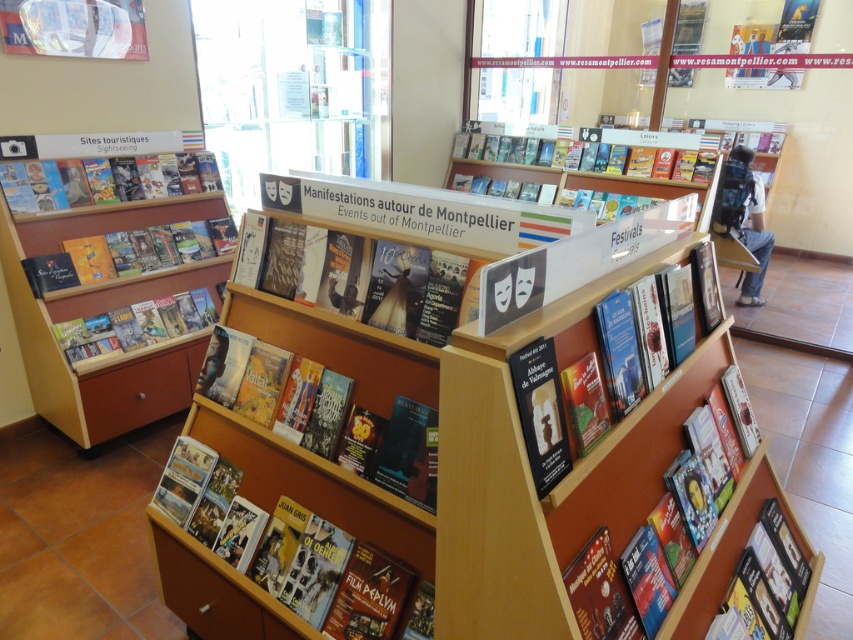
Question: Is matte paper book at center wider than hardcover book at center?

Choices:
 (A) no
 (B) yes

Answer: (A)

Question: Is matte paper book at center positioned behind matte paper brochure at upper left?

Choices:
 (A) no
 (B) yes

Answer: (A)

Question: Among these objects, which one is farthest from the camera?

Choices:
 (A) matte paper brochure at center
 (B) matte paper brochure at lower center
 (C) matte cardboard book at center

Answer: (A)

Question: Does hardcover book at center have a larger size compared to matte black mask at center?

Choices:
 (A) no
 (B) yes

Answer: (A)

Question: Which object is closer to the camera taking this photo?

Choices:
 (A) matte black mask at center
 (B) matte paper brochure at upper left
 (C) wooden bookshelf at right
 (D) matte paper brochure at center

Answer: (C)

Question: Which point is closer to the camera?

Choices:
 (A) matte black book at lower right
 (B) matte black book at left
 (C) matte cardboard book at center

Answer: (C)